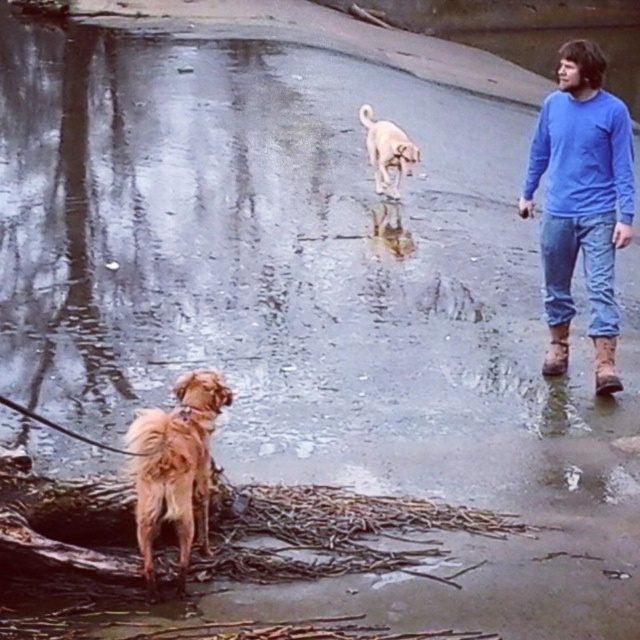
Does blue cotton sweatshirt at right appear over golden fur dog at upper center?

No, blue cotton sweatshirt at right is not above golden fur dog at upper center.

The height and width of the screenshot is (640, 640). In order to click on blue cotton sweatshirt at right in this screenshot , I will do `click(582, 156)`.

The height and width of the screenshot is (640, 640). What are the coordinates of `blue cotton sweatshirt at right` in the screenshot? It's located at (582, 156).

Is blue cotton shirt at right to the right of golden fur dog at lower left from the viewer's perspective?

Correct, you'll find blue cotton shirt at right to the right of golden fur dog at lower left.

Between point (602, 161) and point (193, 372), which one is positioned behind?

The point (602, 161) is behind.

Where is `blue cotton shirt at right`? blue cotton shirt at right is located at coordinates (580, 204).

Between point (168, 483) and point (381, 122), which one is positioned behind?

The point (381, 122) is behind.

Is point (209, 374) closer to viewer compared to point (380, 124)?

Yes, it is.

Which is behind, point (150, 529) or point (410, 145)?

Point (410, 145)

You are a GUI agent. You are given a task and a screenshot of the screen. Output one action in this format:
    pyautogui.click(x=<x>, y=<y>)
    Task: Click on the golden fur dog at lower left
    
    Given the screenshot: What is the action you would take?
    pyautogui.click(x=176, y=467)